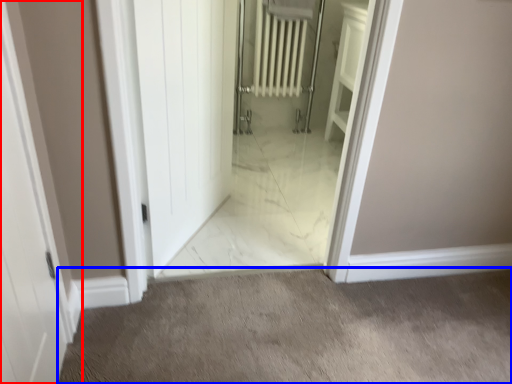
Question: Among these objects, which one is nearest to the camera, door (highlighted by a red box) or granite (highlighted by a blue box)?

Choices:
 (A) door
 (B) granite

Answer: (A)